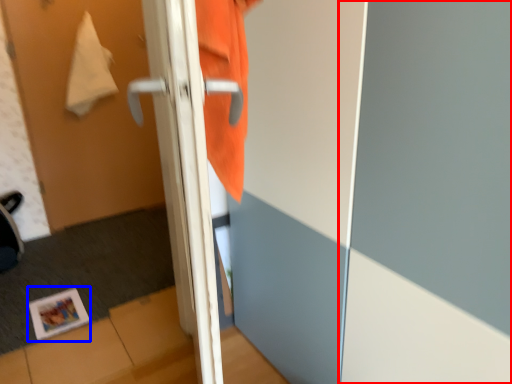
Question: Which object is further to the camera taking this photo, screen door (highlighted by a red box) or magazine (highlighted by a blue box)?

Choices:
 (A) screen door
 (B) magazine

Answer: (B)